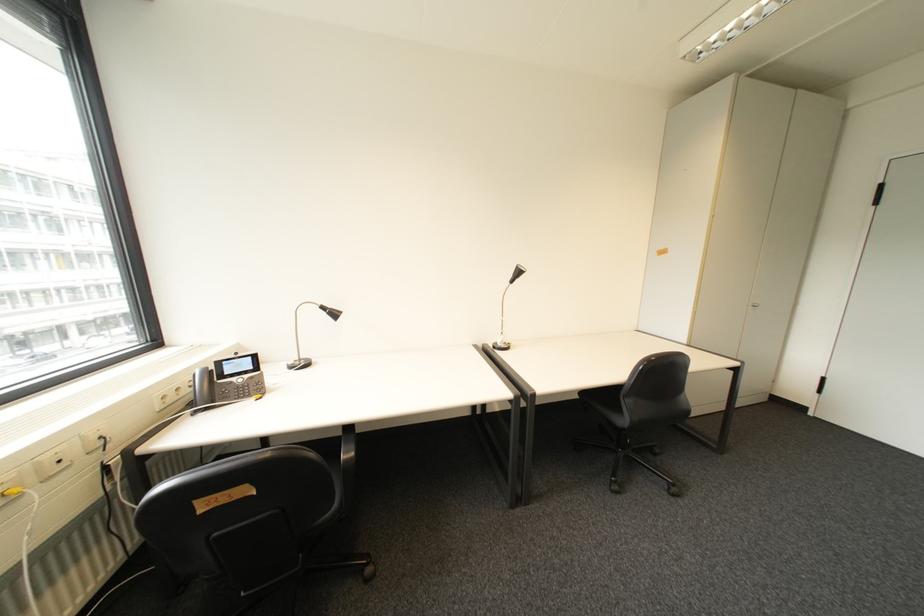
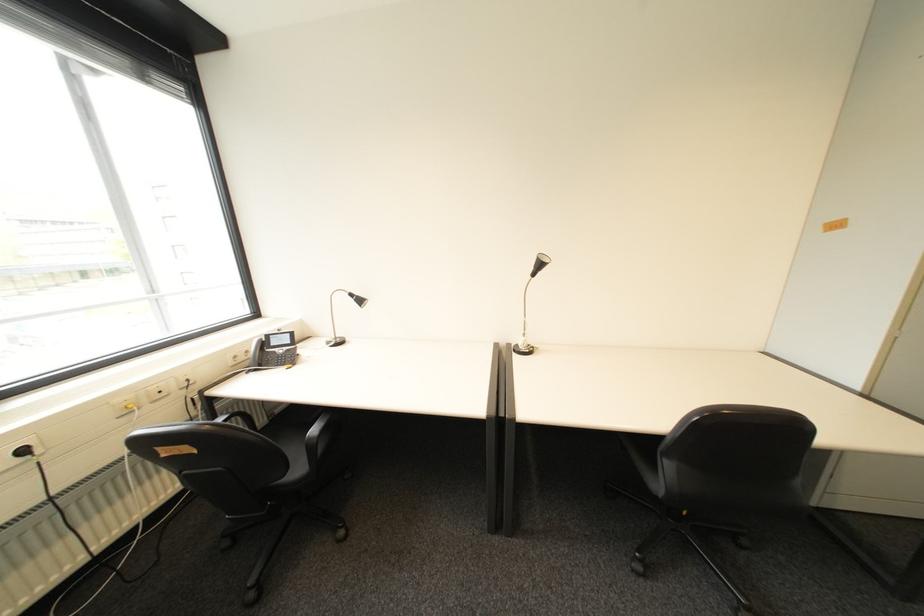
Locate, in the second image, the point that corresponds to pixel 237 374 in the first image.

(283, 345)